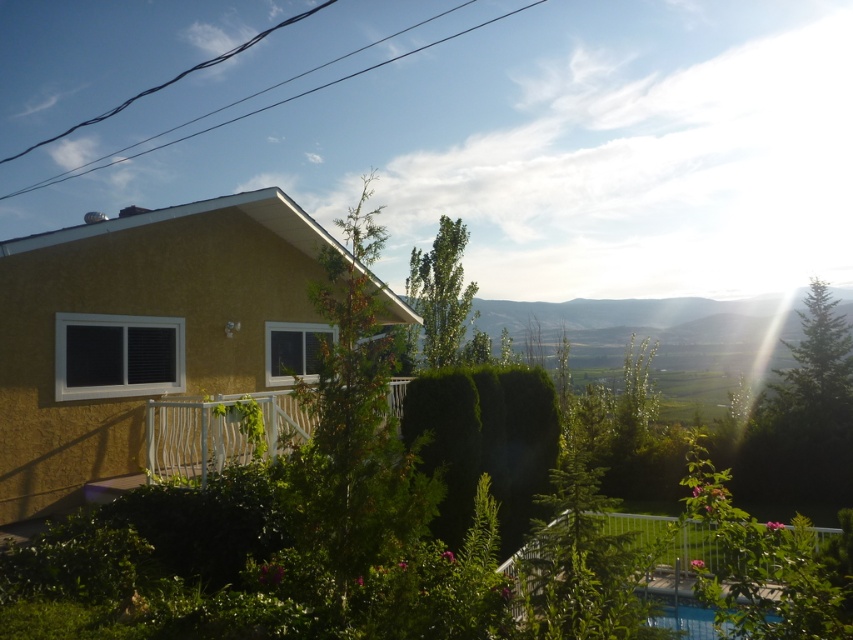
Question: Does black wire at upper center have a greater width compared to transparent glass pool at lower right?

Choices:
 (A) no
 (B) yes

Answer: (B)

Question: Is black wire at upper center further to camera compared to transparent glass pool at lower right?

Choices:
 (A) no
 (B) yes

Answer: (B)

Question: Can you confirm if black wire at upper center is wider than transparent glass pool at lower right?

Choices:
 (A) no
 (B) yes

Answer: (B)

Question: Which point is farther from the camera taking this photo?

Choices:
 (A) (672, 612)
 (B) (515, 12)

Answer: (B)